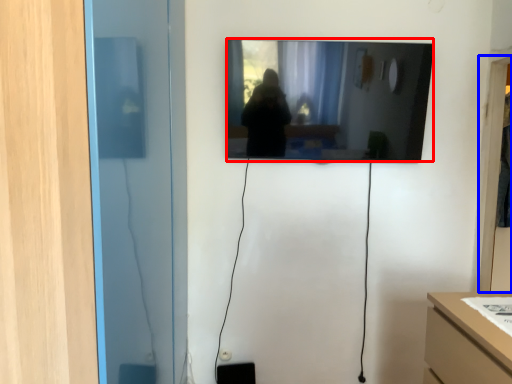
Question: Which of the following is the closest to the observer, mirror (highlighted by a red box) or glass door (highlighted by a blue box)?

Choices:
 (A) mirror
 (B) glass door

Answer: (A)